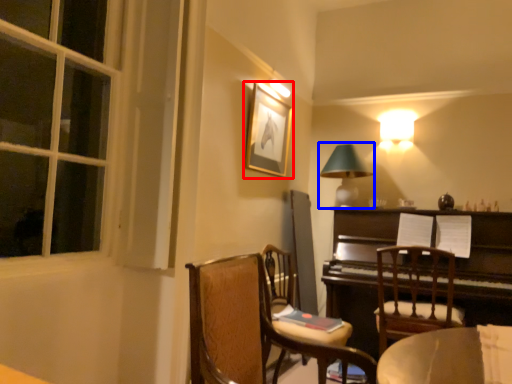
Question: Which object is closer to the camera taking this photo, picture frame (highlighted by a red box) or table lamp (highlighted by a blue box)?

Choices:
 (A) picture frame
 (B) table lamp

Answer: (A)